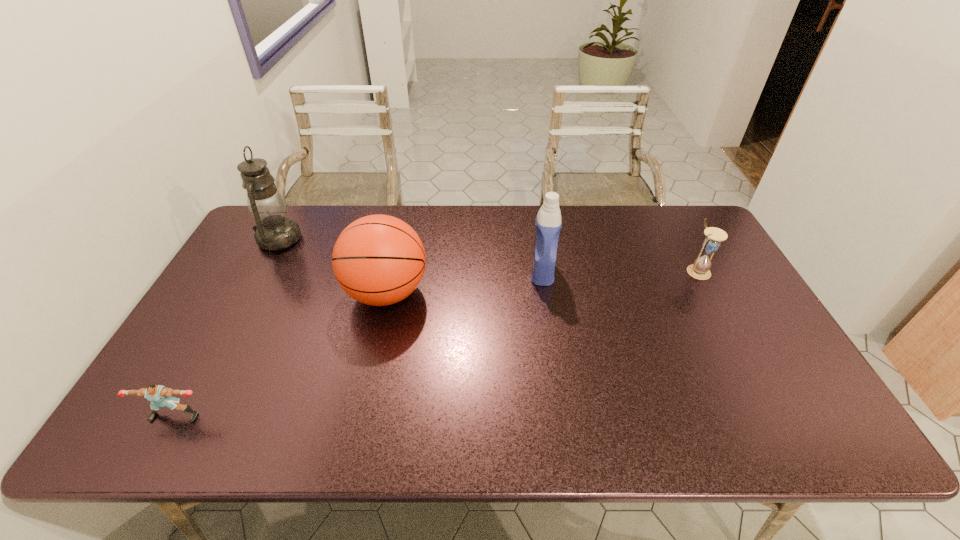
Image resolution: width=960 pixels, height=540 pixels. Find the location of `free spot located on the left of the fourth tallest object`. free spot located on the left of the fourth tallest object is located at coordinates (576, 271).

Find the location of a particular element. object that is positioned at the far edge is located at coordinates (274, 231).

What are the coordinates of `object at the near edge` in the screenshot? It's located at pos(160,396).

This screenshot has width=960, height=540. What are the coordinates of `oil lamp at the left edge` in the screenshot? It's located at (274, 231).

What are the coordinates of `puncher that is at the left edge` in the screenshot? It's located at (160, 396).

Where is `object that is at the right edge`? The height and width of the screenshot is (540, 960). object that is at the right edge is located at coordinates (700, 269).

The height and width of the screenshot is (540, 960). Find the location of `object that is at the far left corner`. object that is at the far left corner is located at coordinates (274, 231).

Identify the location of object at the near left corner. The height and width of the screenshot is (540, 960). (160, 396).

The height and width of the screenshot is (540, 960). I want to click on vacant space at the far edge of the desktop, so click(x=422, y=231).

In the image, there is a desktop. In order to click on free space at the near edge in this screenshot , I will do `click(632, 436)`.